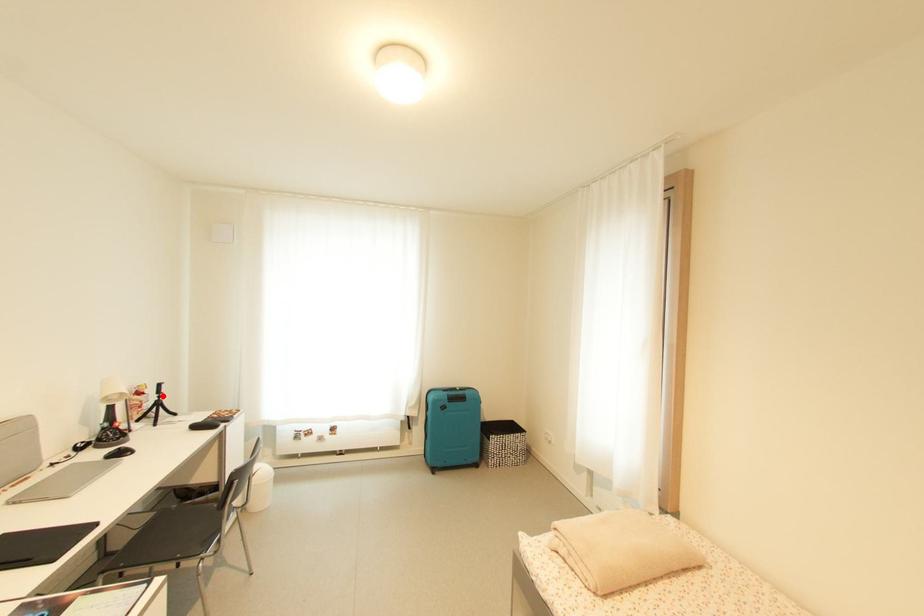
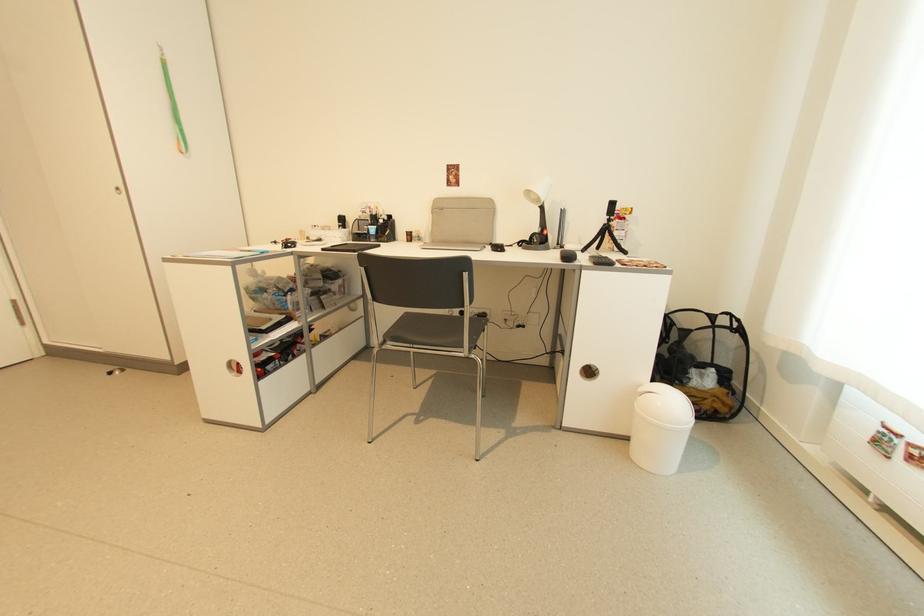
The point at the highlighted location is marked in the first image. Where is the corresponding point in the second image?

(612, 217)